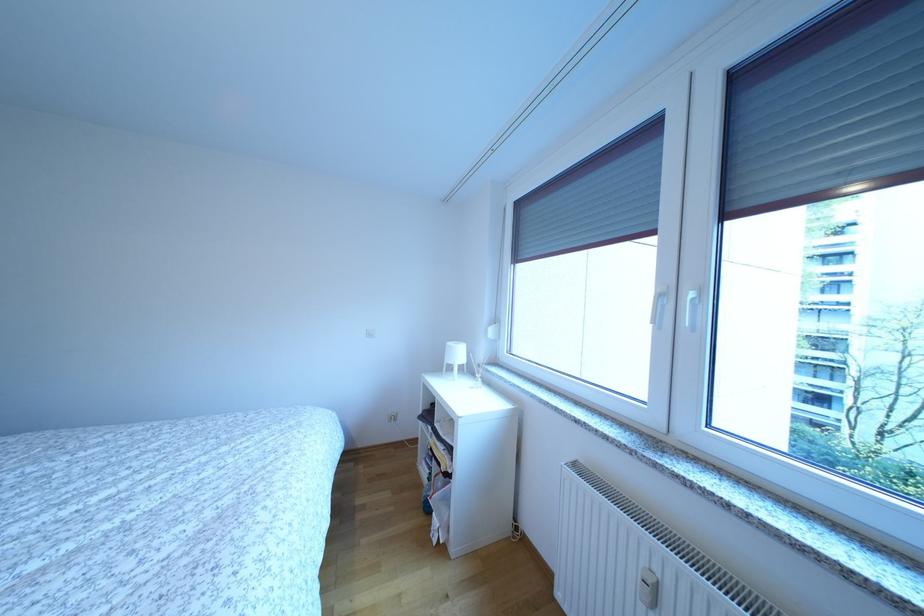
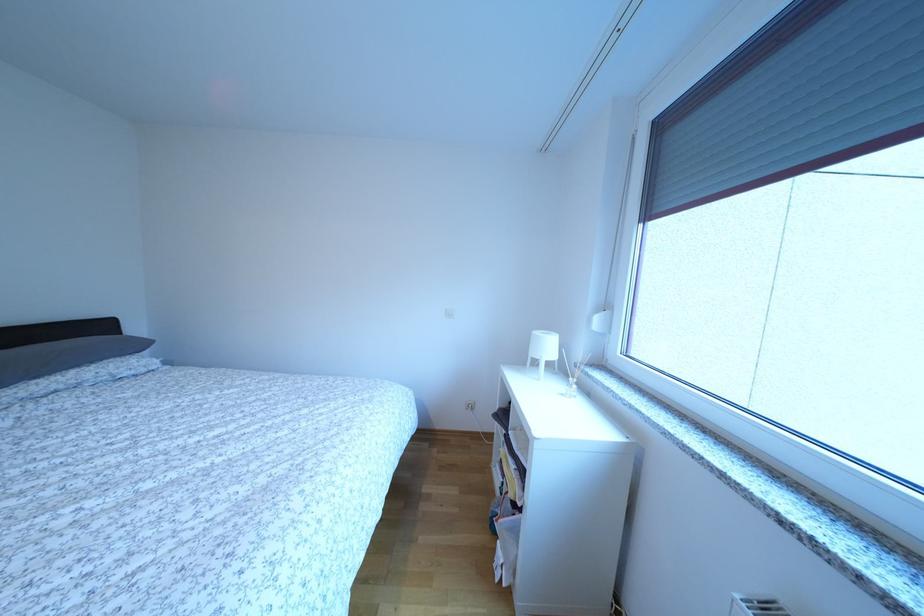
Question: The images are taken continuously from a first-person perspective. In which direction is your viewpoint rotating?

Choices:
 (A) Left
 (B) Right
 (C) Up
 (D) Down

Answer: (A)